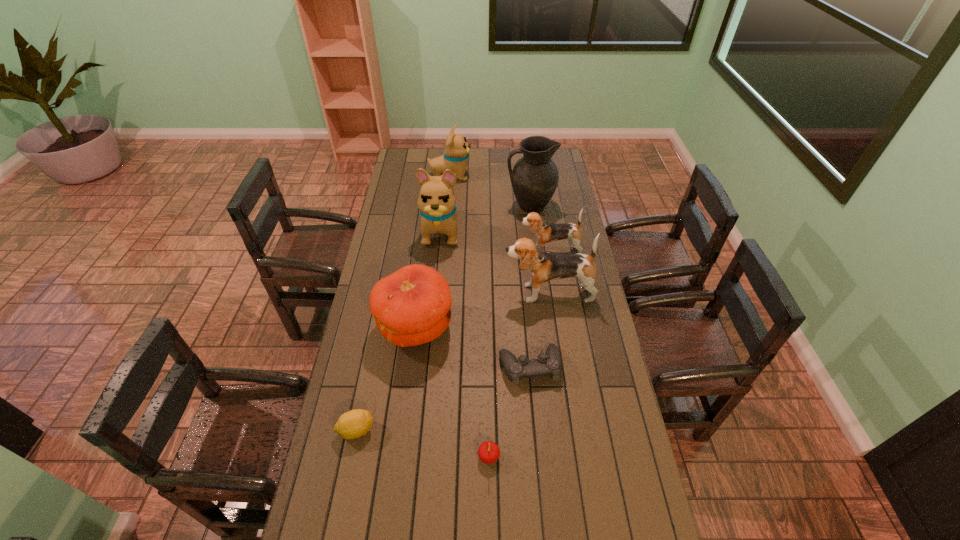
Where is `free space located on the face of the farthest object`? The height and width of the screenshot is (540, 960). free space located on the face of the farthest object is located at coordinates [516, 176].

Locate an element on the screen. free region located 0.190m on the right of the pumpkin is located at coordinates (505, 327).

You are a GUI agent. You are given a task and a screenshot of the screen. Output one action in this format:
    pyautogui.click(x=<x>, y=<y>)
    Task: Click on the free space located at the face of the farther brown puppy
    The width and height of the screenshot is (960, 540).
    Given the screenshot: What is the action you would take?
    pyautogui.click(x=439, y=252)

The height and width of the screenshot is (540, 960). I want to click on vacant point located at the face of the farther brown puppy, so click(x=464, y=252).

Where is `free region located at the face of the farther brown puppy`? free region located at the face of the farther brown puppy is located at coordinates (500, 252).

I want to click on vacant space located 0.200m on the left of the fifth object from right to left, so click(x=411, y=456).

The width and height of the screenshot is (960, 540). I want to click on free space located at the stem end of the lemon, so click(433, 430).

The width and height of the screenshot is (960, 540). In order to click on vacant space located on the left of the control in this screenshot , I will do `click(439, 367)`.

Locate an element on the screen. object at the far edge is located at coordinates (457, 150).

You are a GUI agent. You are given a task and a screenshot of the screen. Output one action in this format:
    pyautogui.click(x=<x>, y=<y>)
    Task: Click on the pumpkin at the left edge
    
    Given the screenshot: What is the action you would take?
    pyautogui.click(x=411, y=306)